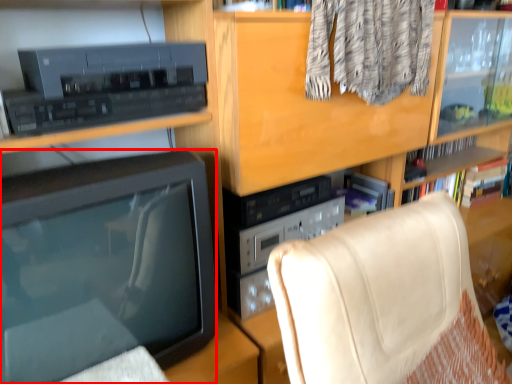
Question: In this image, where is television (annotated by the red box) located relative to furniture?

Choices:
 (A) left
 (B) right

Answer: (A)